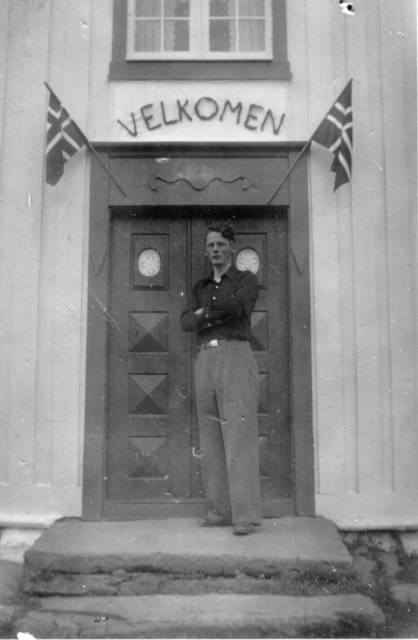
Based on the scene description, where exactly is the smooth gray pants at center located in terms of coordinates?

The smooth gray pants at center is located at coordinates point (226, 385).

Based on the scene described, which object is wider when comparing the wooden door at center and the white fabric flag at upper right?

The wooden door at center is wider than the white fabric flag at upper right.

Based on the scene description, which object is taller between the smooth gray pants at center and the white fabric flag at upper right?

The smooth gray pants at center is taller than the white fabric flag at upper right.